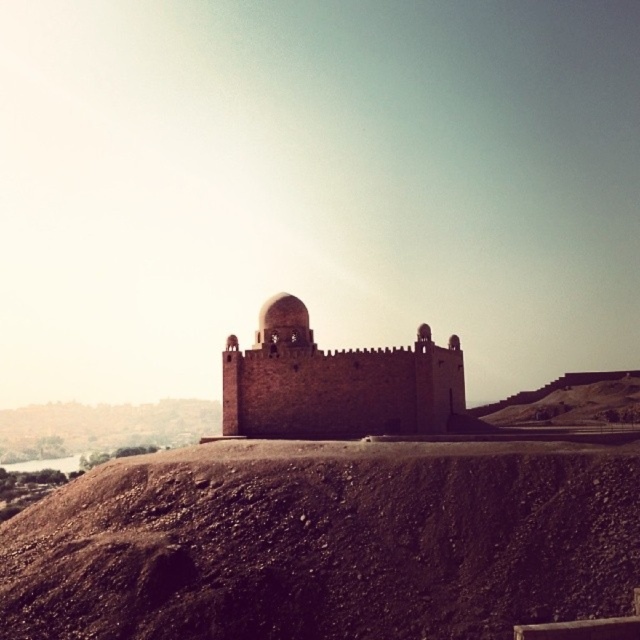
You are an archaeologist examining the site from a distance. You notice the brown dirt mound at center and the matte stone dome at center. Which object is positioned to the right of the other?

The brown dirt mound at center is positioned to the right of the matte stone dome at center.

Consider the image. You are a hiker who wants to climb the brown stone fort at center. You see a brown dirt mound at center nearby. Which one is taller?

The brown stone fort at center is taller than the brown dirt mound at center.

You are standing at the base of the hill and want to reach the brown stone fort at center. If your walking speed is 3 feet per second, how many seconds will it take you to reach the fort?

The distance between you and the brown stone fort at center is 272.91 feet. At a walking speed of 3 feet per second, it will take approximately 90.97 seconds to reach the fort.